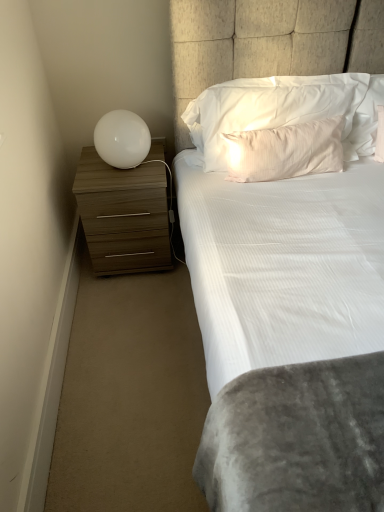
Where is `free point below white glossy sphere at left (from a real-world perspective)`? The width and height of the screenshot is (384, 512). free point below white glossy sphere at left (from a real-world perspective) is located at coordinates (122, 169).